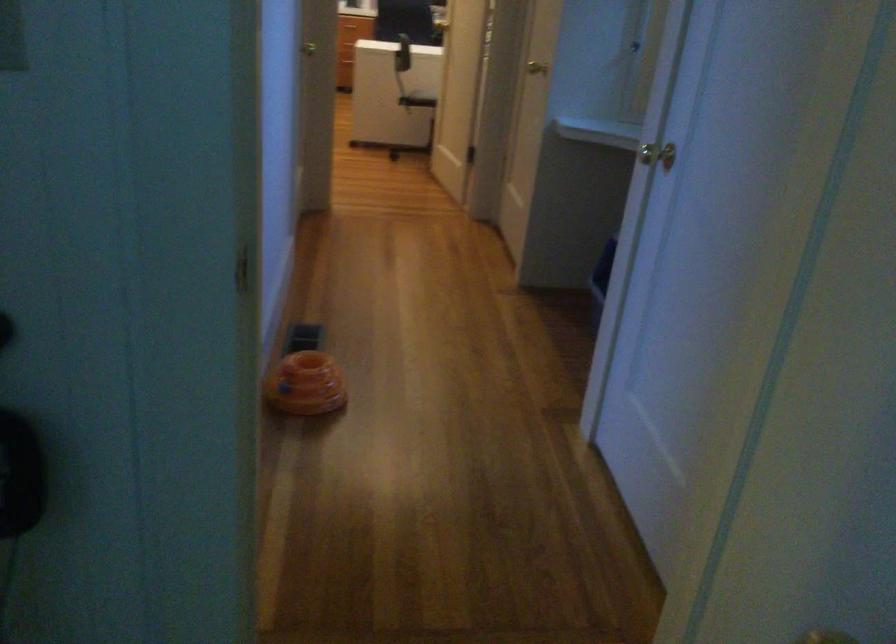
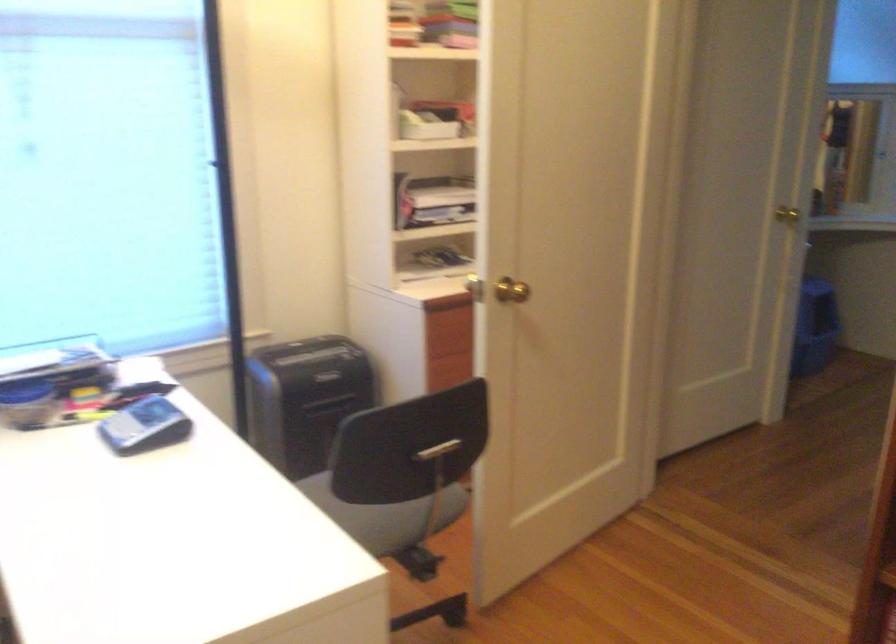
In the second image, find the point that corresponds to the point at 558,69 in the first image.

(787, 214)